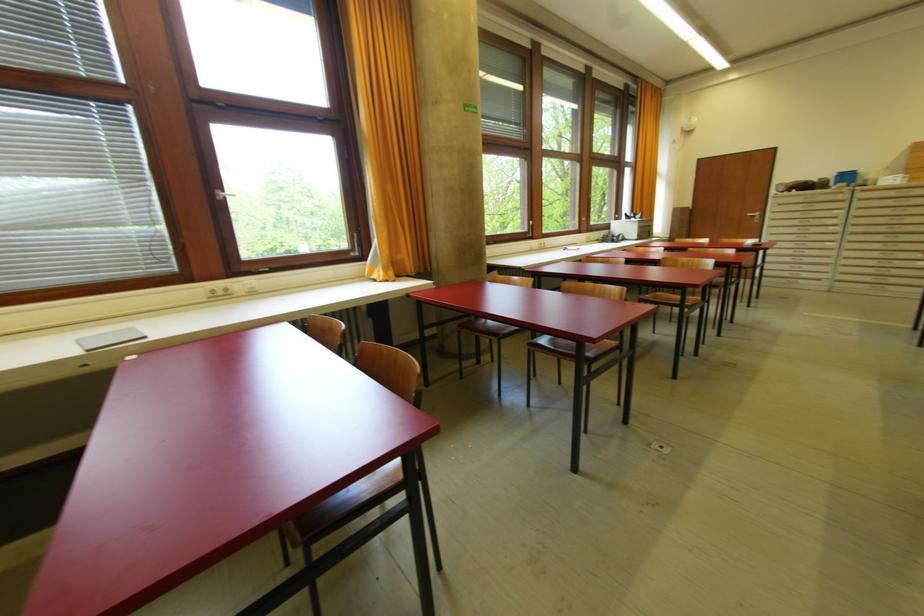
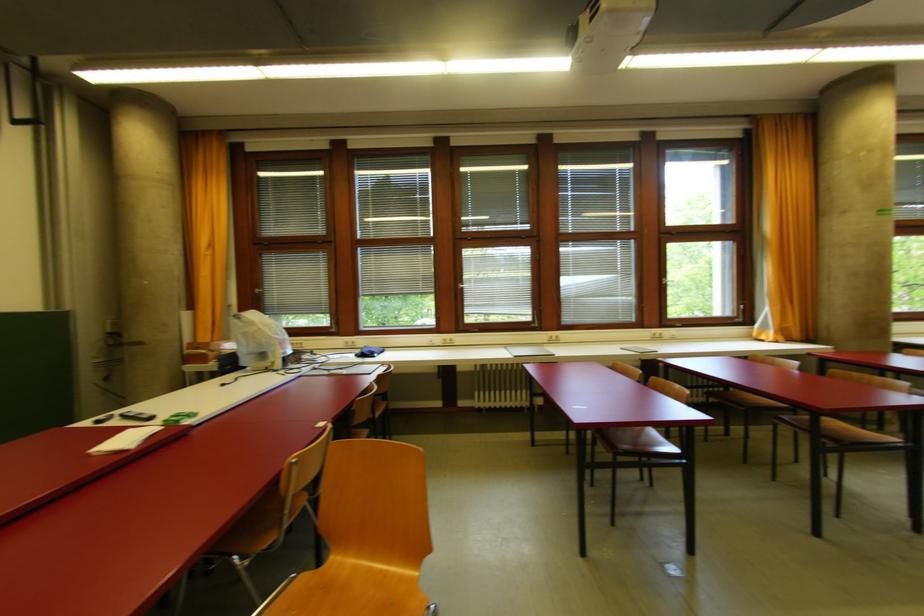
Find the pixel in the second image that matches point (223, 294) in the first image.

(660, 338)